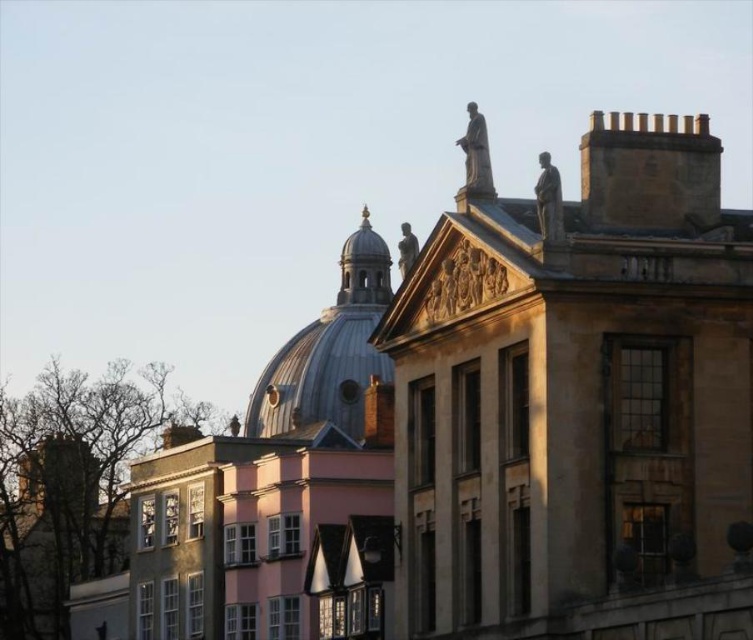
Question: Which object appears closest to the camera in this image?

Choices:
 (A) smooth white dome at center
 (B) beige stone building at upper right

Answer: (B)

Question: In this image, where is beige stone building at upper right located relative to smooth white dome at center?

Choices:
 (A) below
 (B) above

Answer: (B)

Question: Can you confirm if beige stone building at upper right is thinner than smooth white dome at center?

Choices:
 (A) no
 (B) yes

Answer: (A)

Question: Which point appears closest to the camera in this image?

Choices:
 (A) (732, 504)
 (B) (349, 291)

Answer: (A)

Question: Is beige stone building at upper right below smooth white dome at center?

Choices:
 (A) no
 (B) yes

Answer: (A)